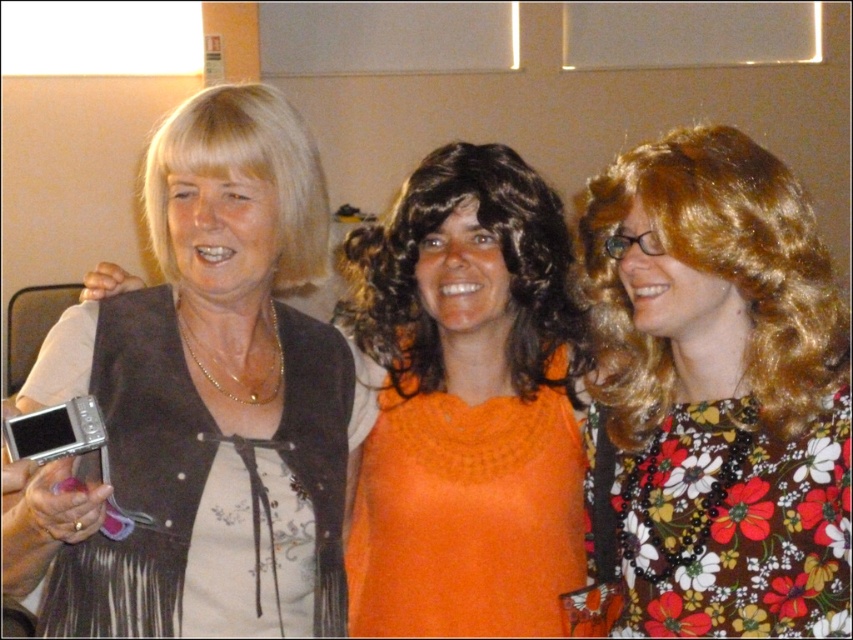
Question: Estimate the real-world distances between objects in this image. Which object is closer to the orange knitted sweater at center?

Choices:
 (A) floral print dress at center
 (B) matte black vest at left

Answer: (A)

Question: Is floral print dress at center thinner than orange knitted sweater at center?

Choices:
 (A) yes
 (B) no

Answer: (A)

Question: Which object is closer to the camera taking this photo?

Choices:
 (A) matte black vest at left
 (B) floral print dress at center

Answer: (A)

Question: Is floral print dress at center above orange knitted sweater at center?

Choices:
 (A) no
 (B) yes

Answer: (B)

Question: Observing the image, what is the correct spatial positioning of floral print dress at center in reference to orange knitted sweater at center?

Choices:
 (A) below
 (B) above

Answer: (B)

Question: Based on their relative distances, which object is farther from the floral print dress at center?

Choices:
 (A) matte black vest at left
 (B) orange knitted sweater at center

Answer: (A)